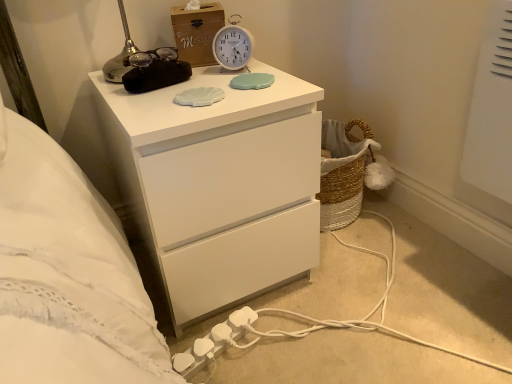
Locate an element on the screen. empty space that is ontop of white matte chest of drawers at upper center is located at coordinates (200, 82).